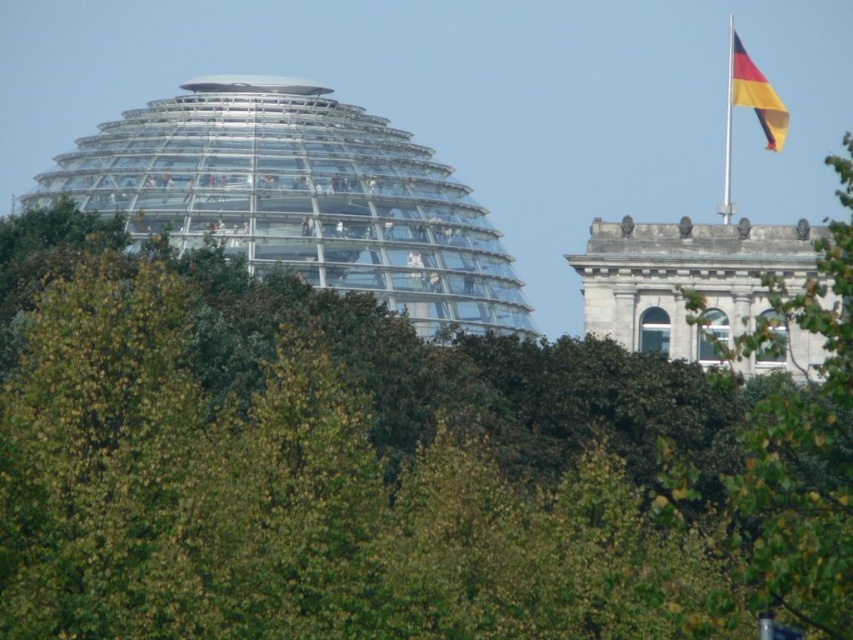
Does white stone tower at upper right have a smaller size compared to yellow and red fabric flag at upper right?

Yes.

Who is more forward, (677, 324) or (776, 145)?

Point (677, 324)

Identify the location of white stone tower at upper right. (685, 280).

Is transparent glass dome at upper left closer to camera compared to green leafy tree at upper right?

No.

Is transparent glass dome at upper left shorter than green leafy tree at upper right?

Yes.

Does point (138, 218) come in front of point (836, 435)?

No, (138, 218) is further to viewer.

Where is `transparent glass dome at upper left`? Image resolution: width=853 pixels, height=640 pixels. transparent glass dome at upper left is located at coordinates (299, 196).

Between green leafy tree at center and yellow and red fabric flag at upper right, which one has more height?

yellow and red fabric flag at upper right

Describe the element at coordinates (379, 468) in the screenshot. I see `green leafy tree at center` at that location.

Find the location of a particular element. The height and width of the screenshot is (640, 853). green leafy tree at center is located at coordinates (379, 468).